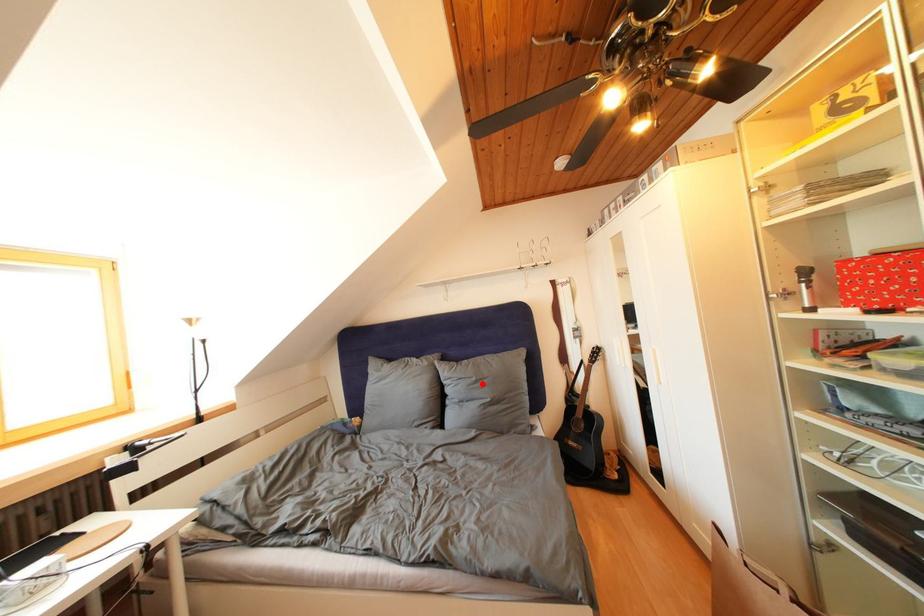
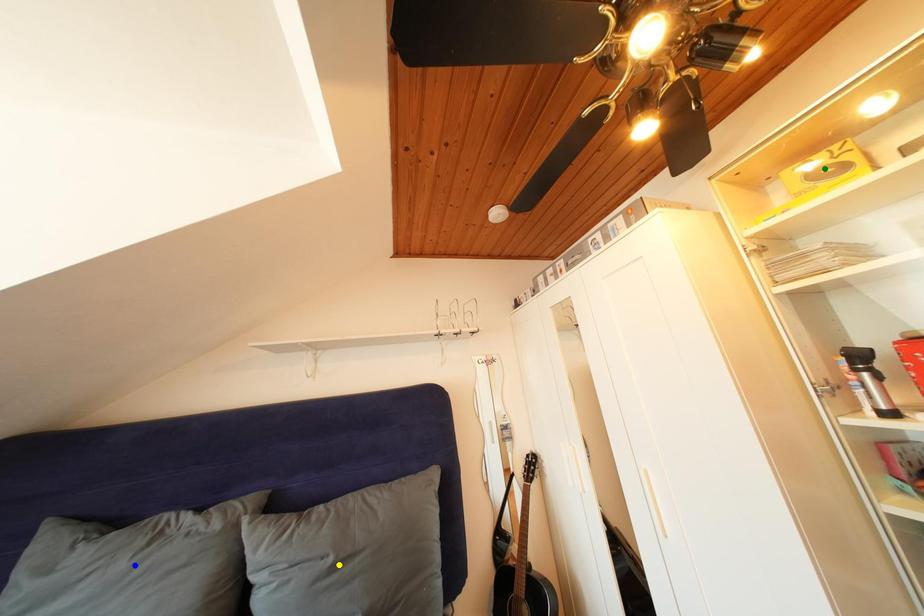
Question: I am providing you with two images of the same scene from different viewpoints. A red point is marked on the first image. You are given multiple points on the second image. Can you choose the point in image 2 that corresponds to the point in image 1?

Choices:
 (A) green point
 (B) blue point
 (C) yellow point

Answer: (C)